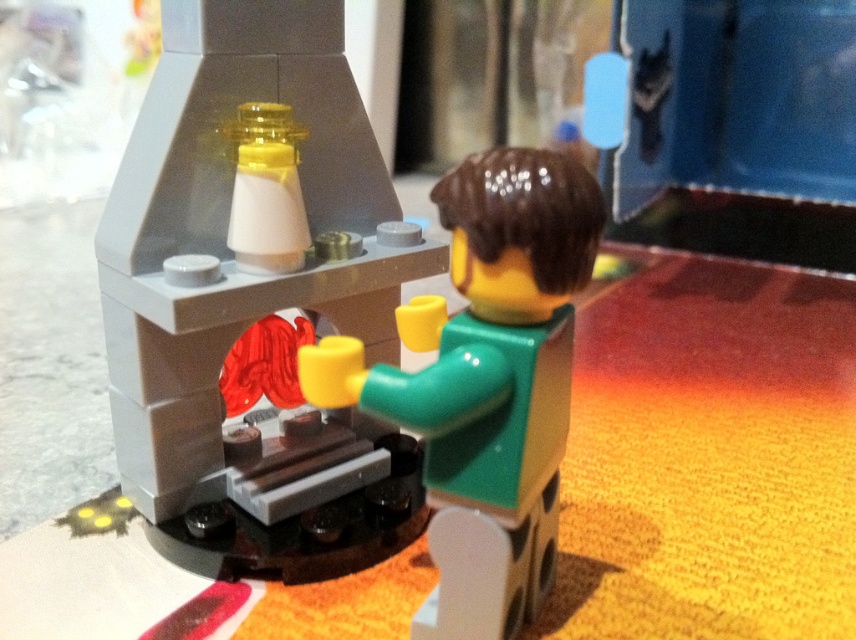
Is smooth gray fireplace at center taller than green matte figure at center?

Yes, smooth gray fireplace at center is taller than green matte figure at center.

Between smooth gray fireplace at center and green matte figure at center, which one is positioned higher?

Positioned higher is smooth gray fireplace at center.

Is point (256, 154) in front of point (524, 404)?

No, it is not.

At what (x,y) coordinates should I click in order to perform the action: click on smooth gray fireplace at center. Please return your answer as a coordinate pair (x, y). Image resolution: width=856 pixels, height=640 pixels. Looking at the image, I should click on click(254, 298).